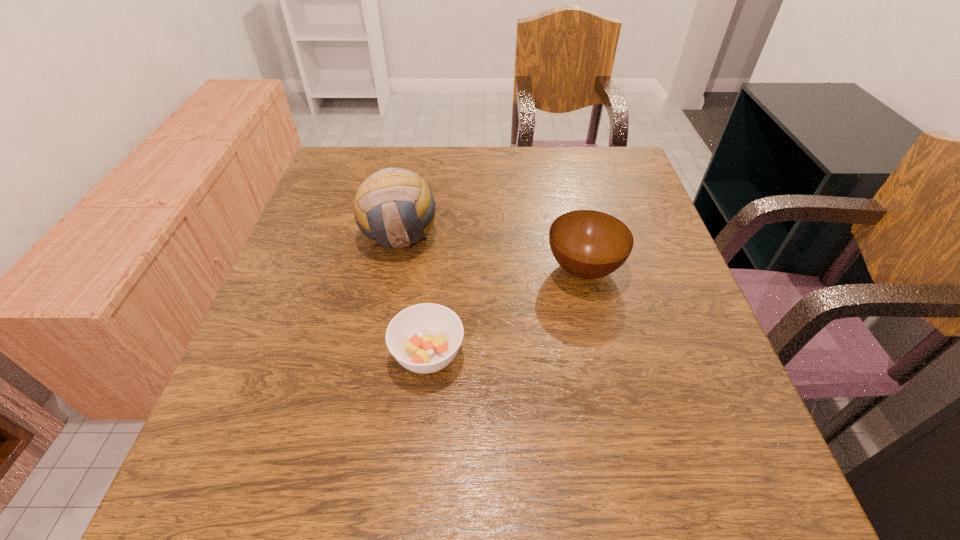
At what (x,y) coordinates should I click in order to perform the action: click on free space between the nearest object and the rightmost object. Please return your answer as a coordinate pair (x, y). This screenshot has width=960, height=540. Looking at the image, I should click on (506, 312).

I want to click on vacant area that lies between the second shortest object and the nearest object, so click(x=506, y=312).

At what (x,y) coordinates should I click in order to perform the action: click on unoccupied position between the second tallest object and the tallest object. Please return your answer as a coordinate pair (x, y). The width and height of the screenshot is (960, 540). Looking at the image, I should click on (492, 252).

Identify the location of vacant space that's between the tallest object and the second shortest object. Image resolution: width=960 pixels, height=540 pixels. (492, 252).

Image resolution: width=960 pixels, height=540 pixels. What are the coordinates of `vacant space in between the tallest object and the bowl` in the screenshot? It's located at (492, 252).

Find the location of `the closest object to the volleyball`. the closest object to the volleyball is located at coordinates (424, 338).

Point out which object is positioned as the nearest to the bowl. Please provide its 2D coordinates. Your answer should be formatted as a tuple, i.e. [(x, y)], where the tuple contains the x and y coordinates of a point satisfying the conditions above.

[(424, 338)]

Where is `vacant space that satisfies the following two spatial constraints: 1. on the front side of the tallest object; 2. on the right side of the shortest object`? vacant space that satisfies the following two spatial constraints: 1. on the front side of the tallest object; 2. on the right side of the shortest object is located at coordinates (376, 354).